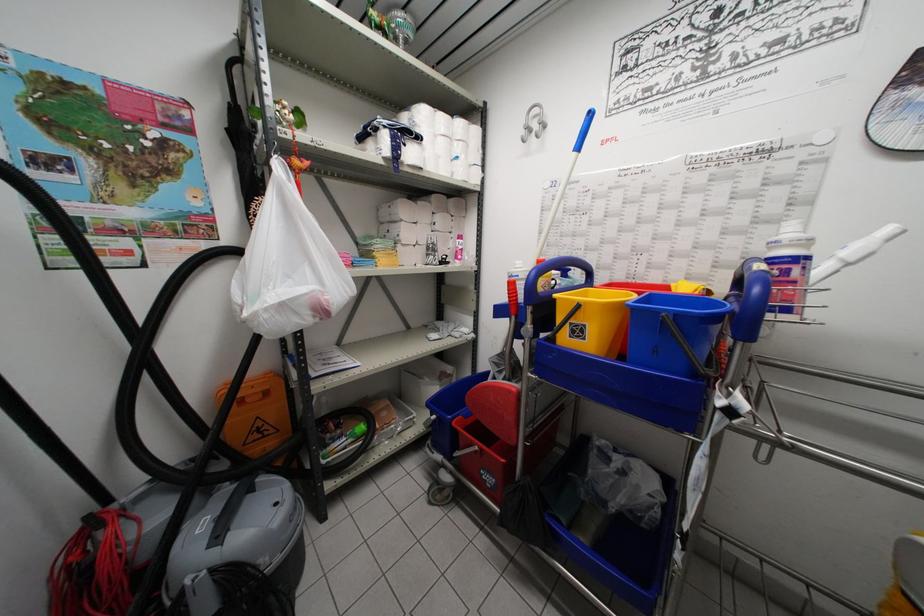
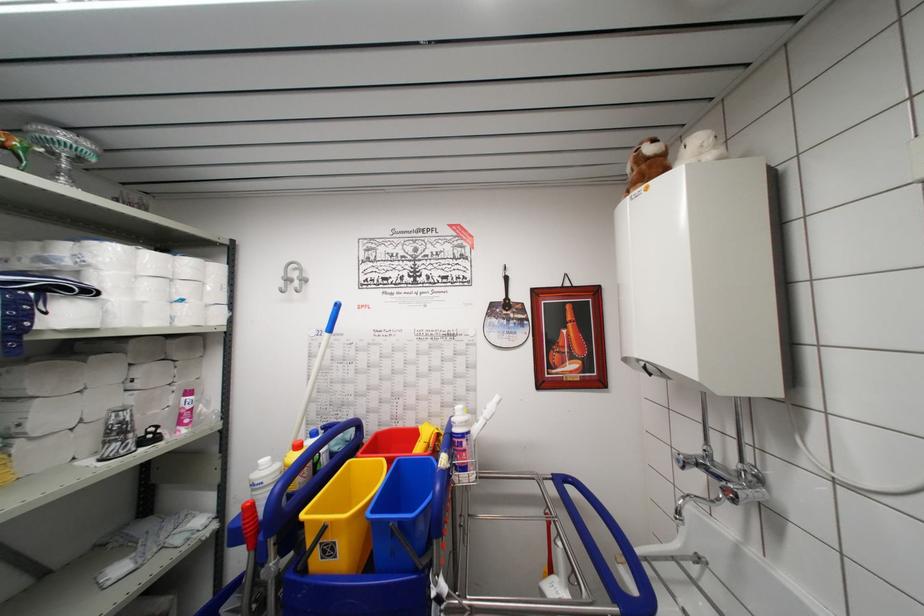
Where in the second image is the point corresponding to [654,299] from the first image?

(402, 466)